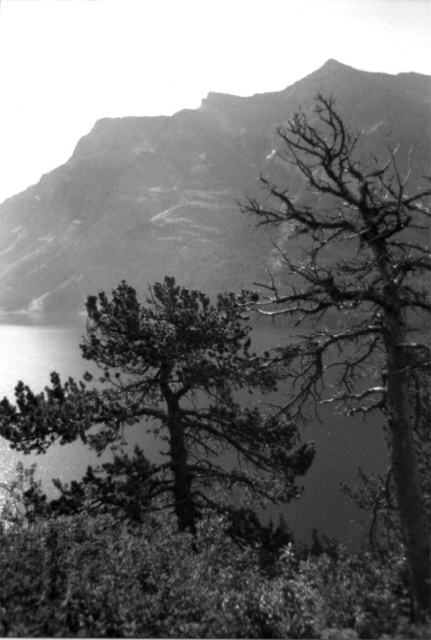
Question: Which object is farther from the camera taking this photo?

Choices:
 (A) dark green textured tree at center
 (B) dead wood tree at upper right

Answer: (A)

Question: In this image, where is rugged stone mountain at upper center located relative to dark green textured tree at center?

Choices:
 (A) below
 (B) above

Answer: (B)

Question: Is dark green textured tree at center positioned in front of dead wood tree at upper right?

Choices:
 (A) yes
 (B) no

Answer: (B)

Question: Which of the following is the farthest from the observer?

Choices:
 (A) (303, 92)
 (B) (114, 362)
 (C) (299, 273)

Answer: (A)

Question: Which of the following is the closest to the observer?

Choices:
 (A) dead wood tree at upper right
 (B) rugged stone mountain at upper center
 (C) dark green textured tree at center

Answer: (A)

Question: Does rugged stone mountain at upper center appear over dead wood tree at upper right?

Choices:
 (A) yes
 (B) no

Answer: (A)